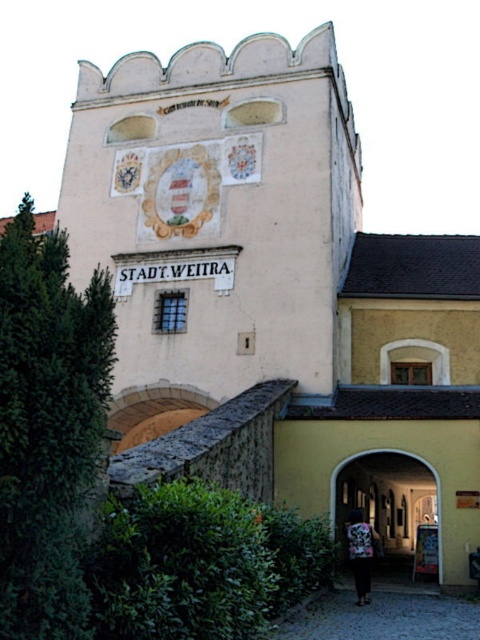
You are a visitor at the gatehouse and notice a dark fabric bag at center and a matte stone archway at center. Which object is closer to you?

The dark fabric bag at center is closer to you because it is in front of the matte stone archway at center.

You are a traveler carrying a dark fabric bag at center and want to pass through the matte stone archway at center. Can your bag fit through the archway?

The dark fabric bag at center has a lesser width compared to matte stone archway at center, so the bag can fit through the archway since it is narrower than the archway.